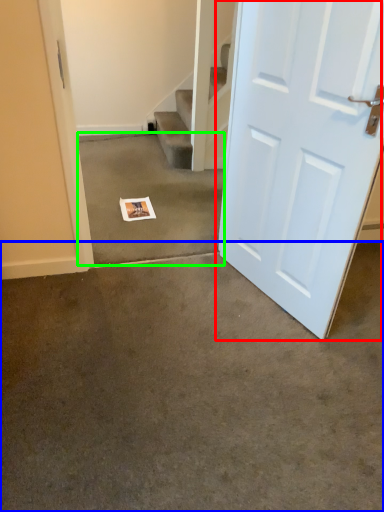
Question: Based on their relative distances, which object is nearer to door (highlighted by a red box)? Choose from concrete (highlighted by a blue box) and concrete (highlighted by a green box).

Choices:
 (A) concrete
 (B) concrete

Answer: (A)